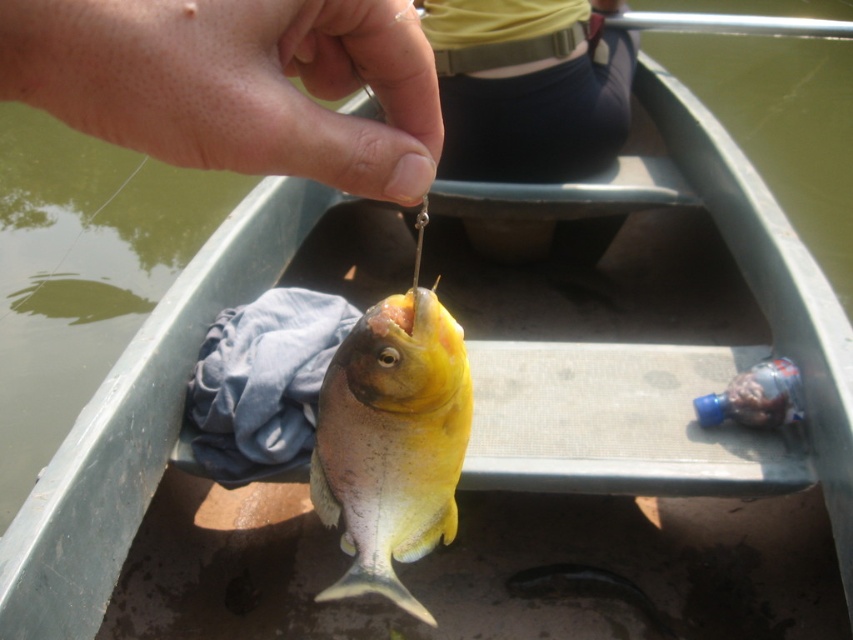
Question: Can you confirm if dry skin at center is smaller than yellow matte fish at center?

Choices:
 (A) no
 (B) yes

Answer: (B)

Question: Is dry skin at center bigger than yellow matte fish at center?

Choices:
 (A) no
 (B) yes

Answer: (A)

Question: Which object appears farthest from the camera in this image?

Choices:
 (A) dry skin at center
 (B) yellow matte fish at center

Answer: (B)

Question: Is dry skin at center bigger than yellow matte fish at center?

Choices:
 (A) no
 (B) yes

Answer: (A)

Question: Among these objects, which one is nearest to the camera?

Choices:
 (A) dry skin at center
 (B) yellow matte fish at center

Answer: (A)